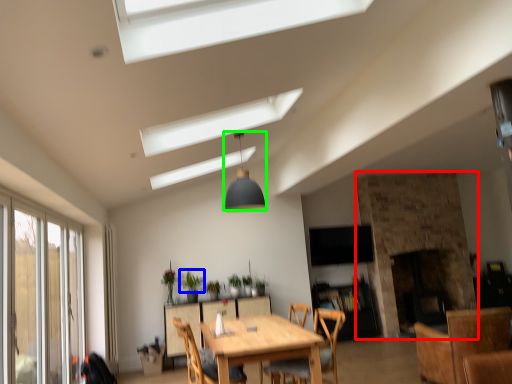
Question: Based on their relative distances, which object is nearer to fireplace (highlighted by a red box)? Choose from plant (highlighted by a blue box) and light fixture (highlighted by a green box).

Choices:
 (A) plant
 (B) light fixture

Answer: (B)